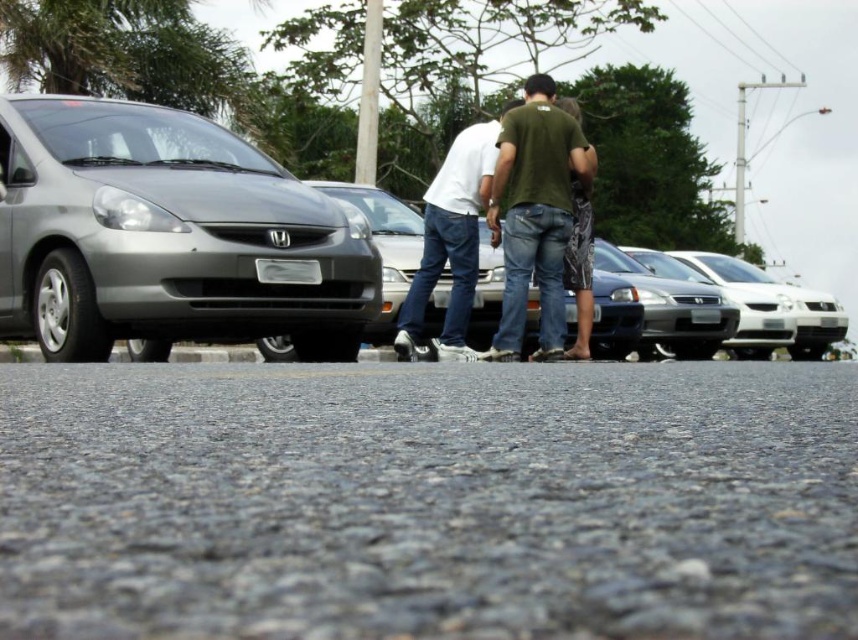
Question: Among these points, which one is farthest from the camera?

Choices:
 (A) (547, 220)
 (B) (0, 284)
 (C) (660, 282)

Answer: (C)

Question: Based on their relative distances, which object is farther from the satin silver car at left?

Choices:
 (A) white glossy sedan at right
 (B) shiny silver sedan at center
 (C) silver metallic sedan at center

Answer: (A)

Question: Is satin silver car at left wider than silver metallic sedan at center?

Choices:
 (A) no
 (B) yes

Answer: (B)

Question: Is satin silver car at left below green cotton shirt at center?

Choices:
 (A) no
 (B) yes

Answer: (B)

Question: Which of these objects is positioned farthest from the shiny silver sedan at center?

Choices:
 (A) green cotton shirt at center
 (B) satin silver car at center
 (C) gray asphalt at center
 (D) silver metallic sedan at center

Answer: (C)

Question: In this image, where is gray asphalt at center located relative to shiny silver sedan at center?

Choices:
 (A) right
 (B) left

Answer: (B)